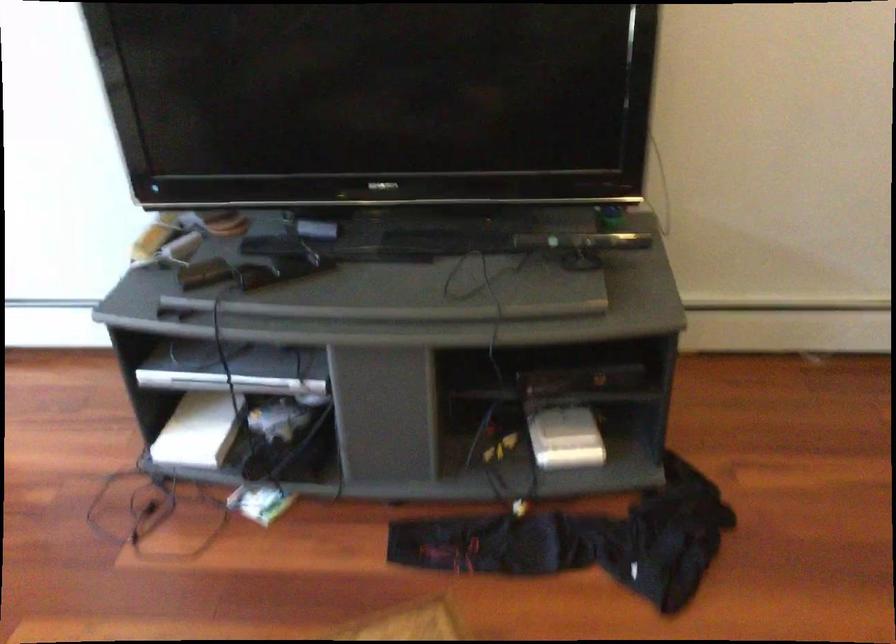
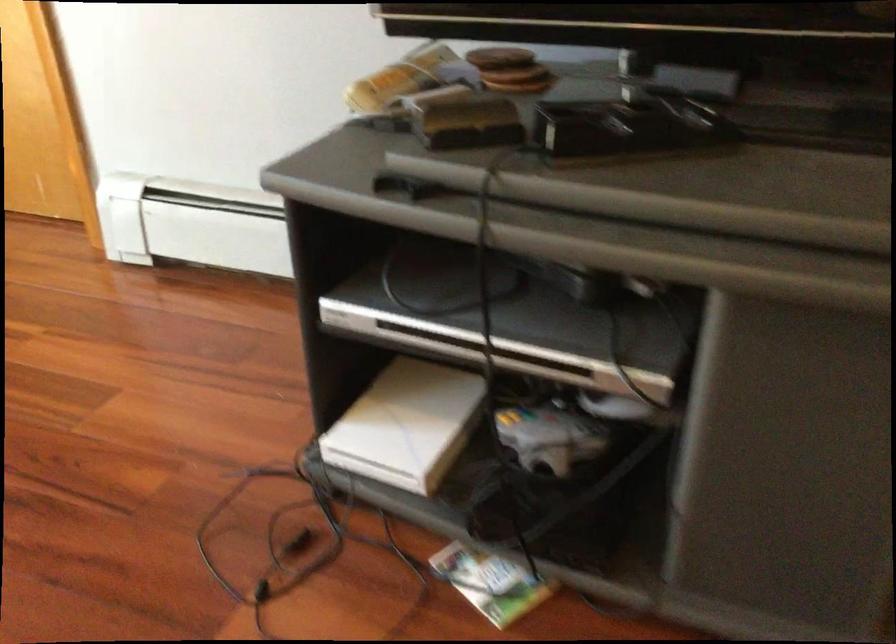
Where in the second image is the point corresponding to point 222,225 from the first image?

(519, 80)